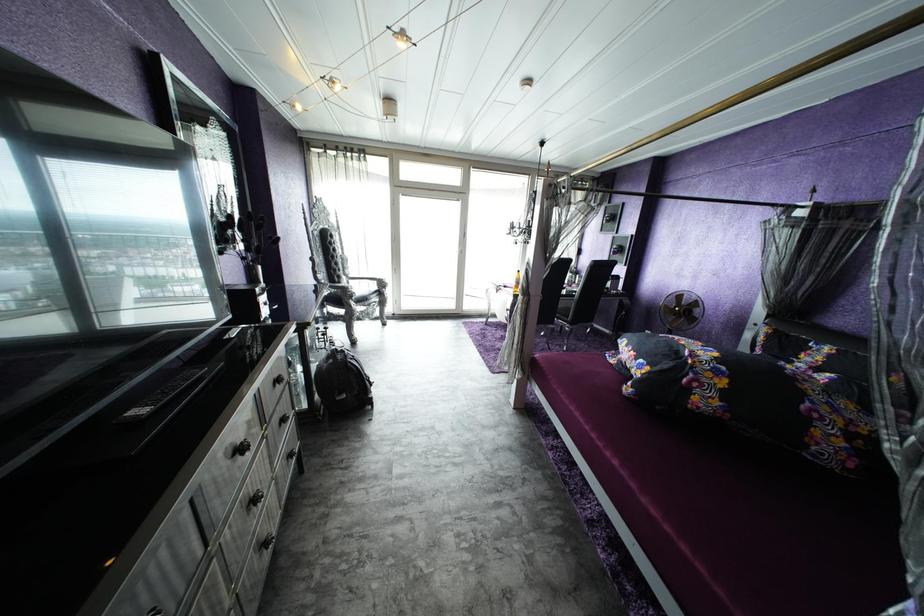
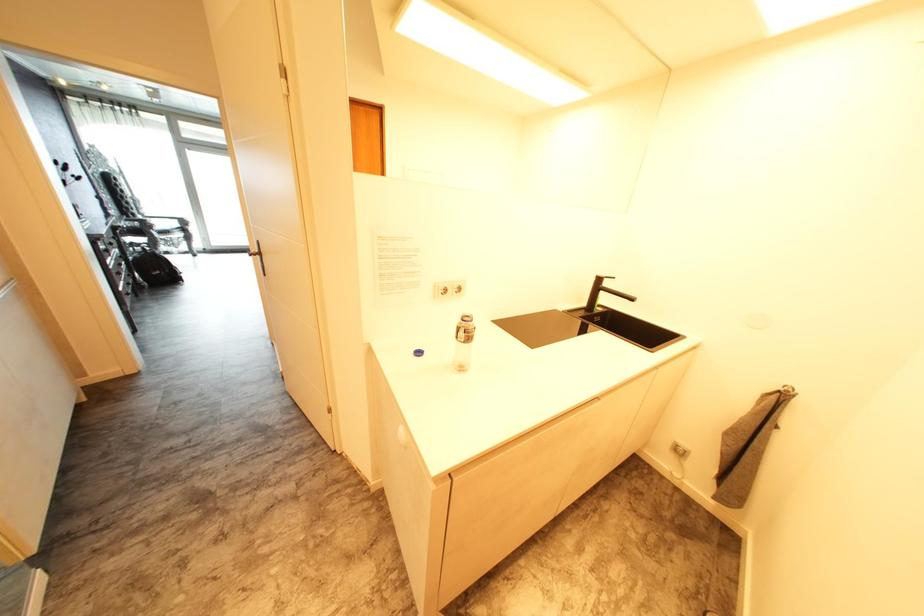
What movement of the cameraman would produce the second image?

The cameraman moved toward right, backward.